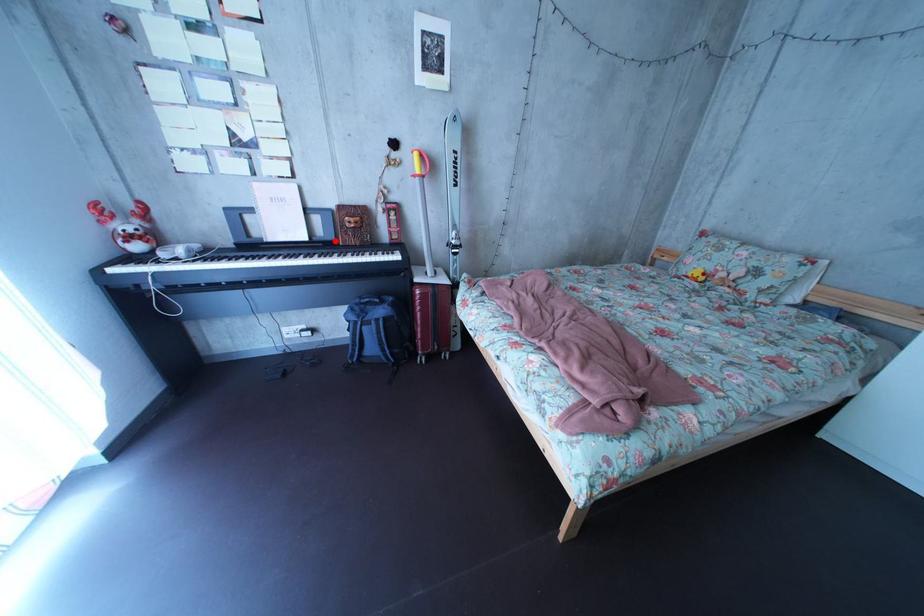
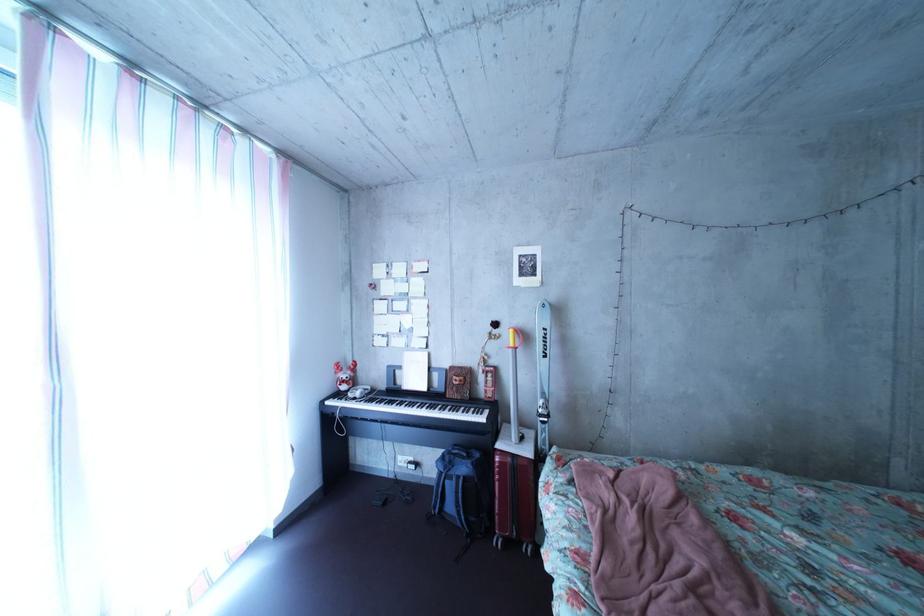
Question: I am providing you with two images of the same scene from different viewpoints. Given a red point in image1, look at the same physical point in image2. Is it:

Choices:
 (A) Closer to the viewpoint
 (B) Farther from the viewpoint

Answer: (B)